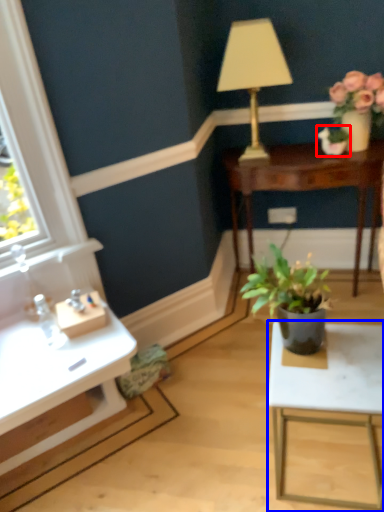
Question: Which of the following is the closest to the observer, houseplant (highlighted by a red box) or table (highlighted by a blue box)?

Choices:
 (A) houseplant
 (B) table

Answer: (B)